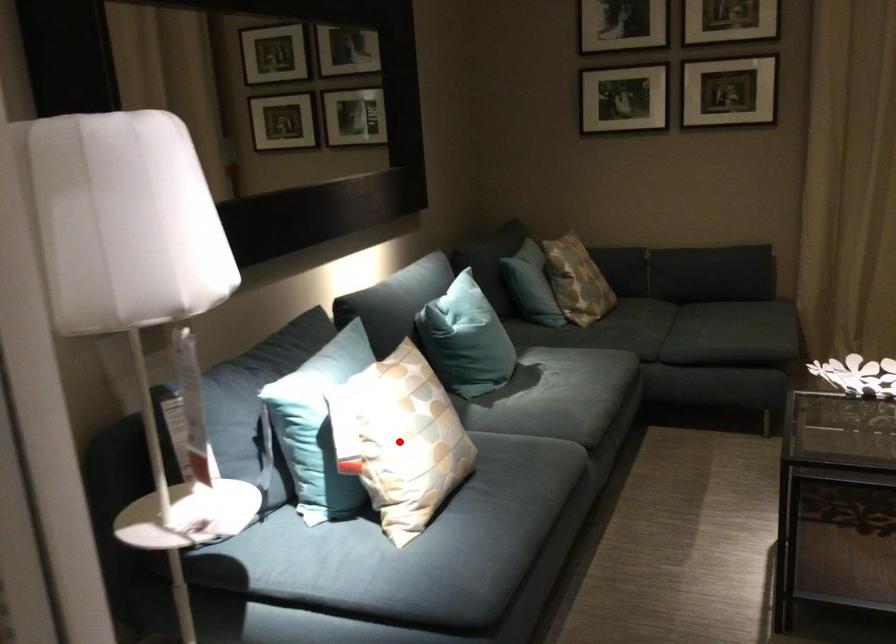
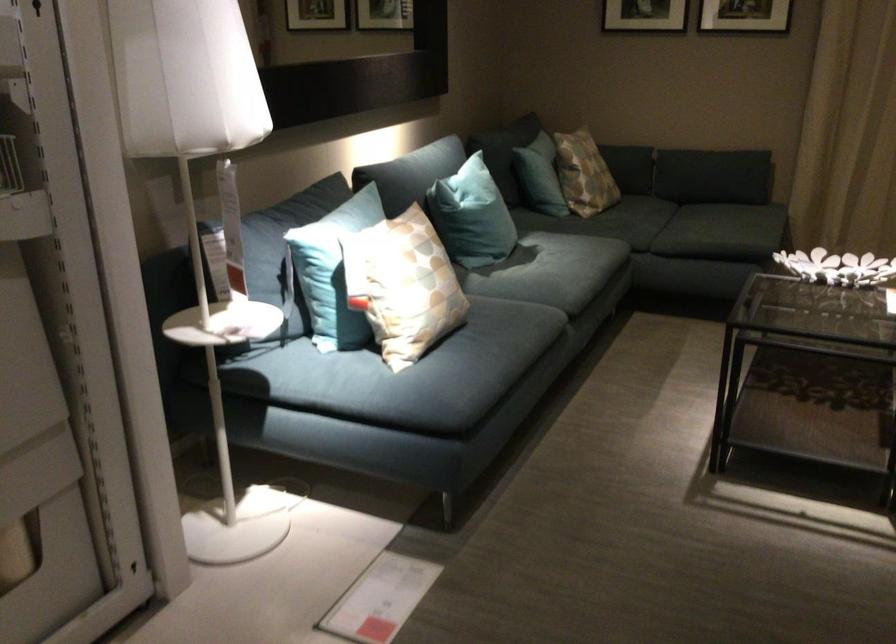
Question: I am providing you with two images of the same scene from different viewpoints. A red point is marked on the first image. Is the red point's position out of view in image 2?

Choices:
 (A) Yes
 (B) No

Answer: (B)